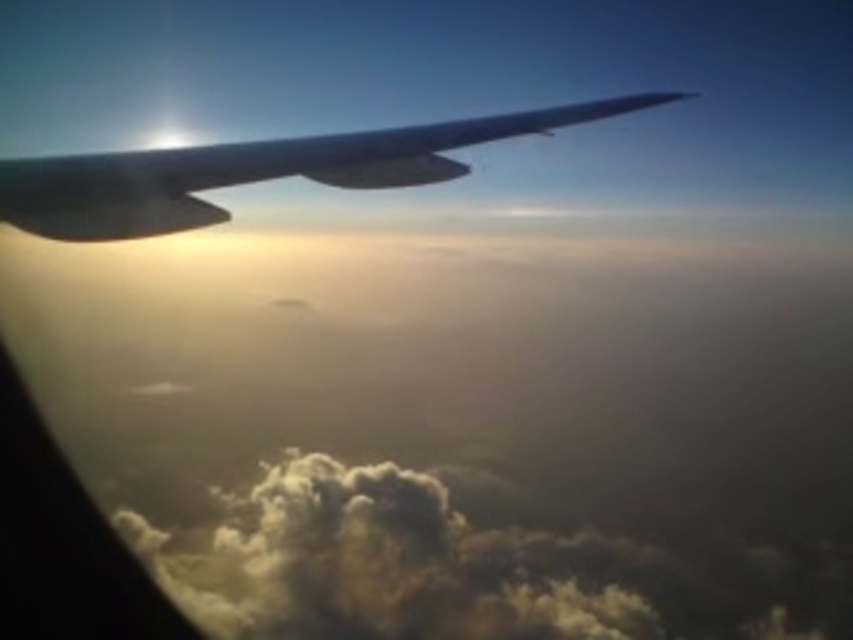
Identify the location of cloudy white at lower left. Image resolution: width=853 pixels, height=640 pixels. (457, 563).

Is cloudy white at lower left further to the viewer compared to satin black wing at upper left?

That is True.

Who is more distant from viewer, [675,612] or [33,188]?

Point [675,612]

Image resolution: width=853 pixels, height=640 pixels. I want to click on cloudy white at lower left, so click(x=457, y=563).